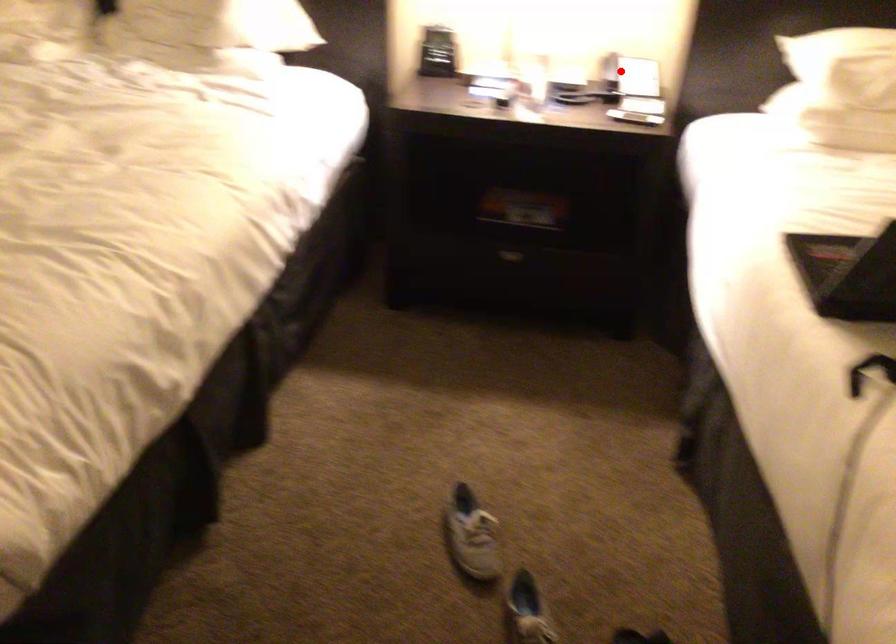
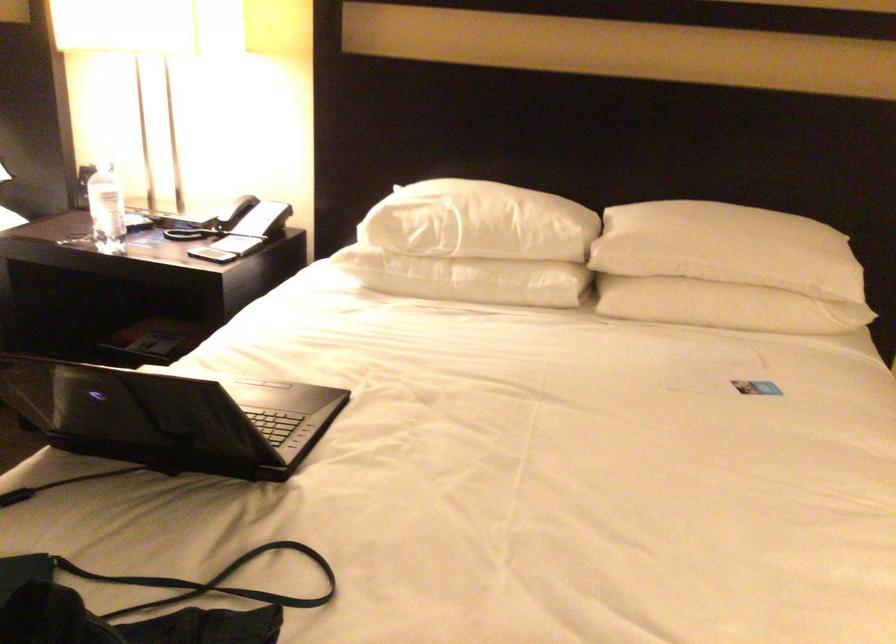
Locate, in the second image, the point that corresponds to the highlighted location in the first image.

(238, 221)